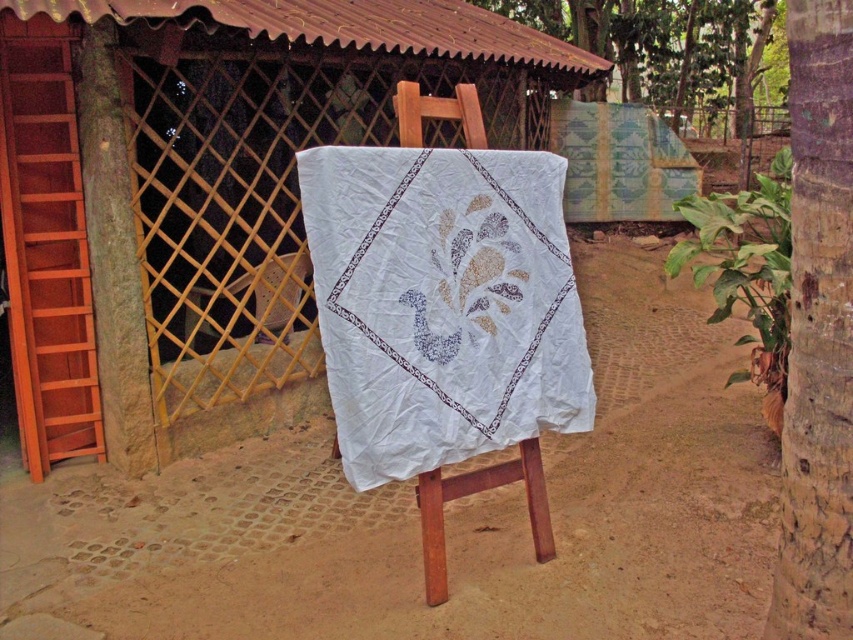
From the picture: You are an artist trying to hang a new piece of fabric on the wooden easel. The wooden lattice at center is currently blocking part of the area where you want to place the white cotton quilt at center. Based on their sizes, which object would you need to adjust first to make space?

The white cotton quilt at center is wider than the wooden lattice at center. Therefore, you should adjust the wooden lattice at center first to accommodate the quilt.

You are planning to set up a small tent in the outdoor scene. The tent requires a clear space that is wider than the wooden lattice at center. Can you determine if the dirt field at center has enough width to accommodate the tent?

The dirt field at center has a larger width than the wooden lattice at center, so it can accommodate the tent that requires a wider space than the wooden lattice at center.

You are standing in the outdoor scene and want to place a small potted plant between the dirt field at center and the wooden lattice at center. Based on their positions, where should you place the potted plant?

The dirt field at center is located below the wooden lattice at center, so you should place the potted plant between the dirt field at center and the wooden lattice at center by positioning it on the ground near the base of the wooden lattice at center where the two objects meet.